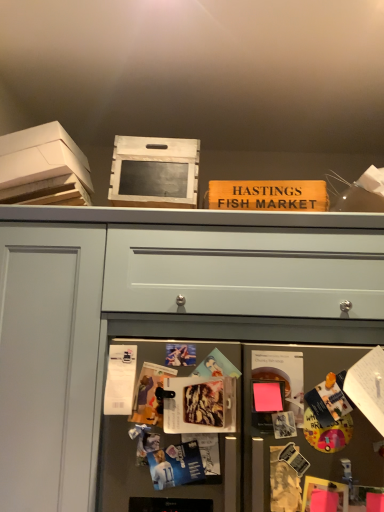
Question: Does point (319, 453) appear closer or farther from the camera than point (52, 202)?

Choices:
 (A) closer
 (B) farther

Answer: (A)

Question: In the image, is metallic gray fridge at lower center positioned in front of or behind white cardboard box at upper left?

Choices:
 (A) front
 (B) behind

Answer: (A)

Question: Estimate the real-world distances between objects in this image. Which object is farther from the white matte drawer at center?

Choices:
 (A) wooden crate at upper center
 (B) matte paper magazine at center, which is the second magazine in front-to-back order
 (C) wooden sign at upper center, placed as the 1th magazine when sorted from top to bottom
 (D) transparent glass door at upper center
 (E) metallic gray fridge at lower center

Answer: (B)

Question: Considering the real-world distances, which object is farthest from the matte paper magazine at center, which is the 2th magazine from back to front?

Choices:
 (A) white matte drawer at center
 (B) wooden sign at upper center, placed as the first magazine when sorted from back to front
 (C) wooden crate at upper center
 (D) metallic gray fridge at lower center
 (E) matte plastic magazine at center, the 3th magazine when ordered from top to bottom

Answer: (B)